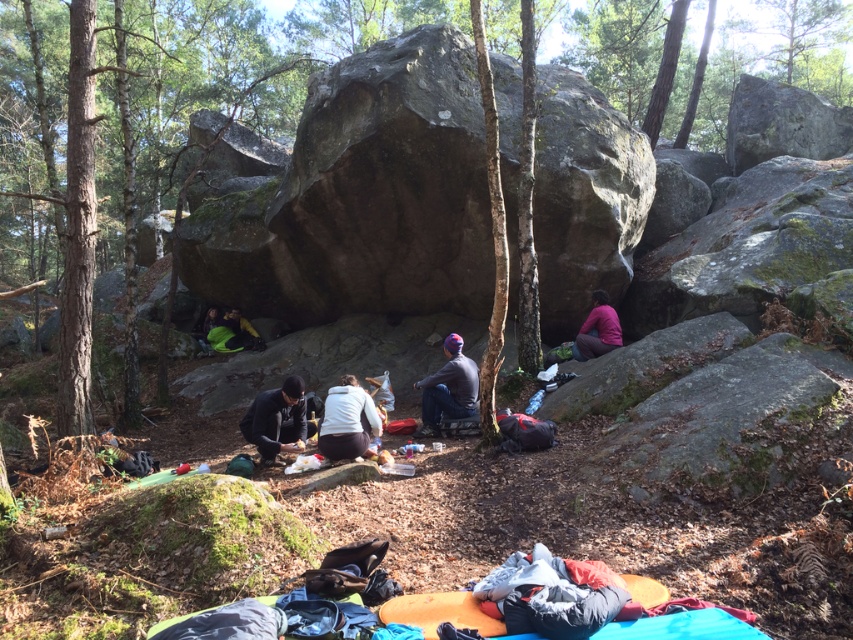
Question: From the image, what is the correct spatial relationship of orange foam pad at lower center in relation to black matte jacket at center?

Choices:
 (A) below
 (B) above

Answer: (A)

Question: Which of the following is the farthest from the observer?

Choices:
 (A) black matte jacket at center
 (B) green mossy tree at center
 (C) pink fabric at center-right
 (D) dark blue fabric jacket at center

Answer: (C)

Question: Which object appears closest to the camera in this image?

Choices:
 (A) black matte jacket at center
 (B) pink fabric at center-right

Answer: (A)

Question: Which object is farther from the camera taking this photo?

Choices:
 (A) white fleece jacket at center
 (B) pink fabric at center-right

Answer: (B)

Question: Does white fleece jacket at center lie behind green fabric bag at lower left?

Choices:
 (A) no
 (B) yes

Answer: (A)

Question: Is the position of gray rough boulder at center more distant than that of white fleece jacket at center?

Choices:
 (A) yes
 (B) no

Answer: (A)